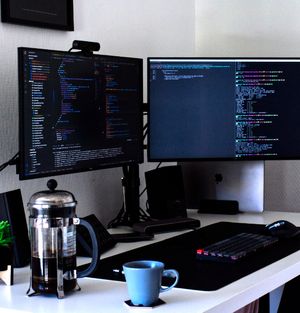
Image resolution: width=300 pixels, height=313 pixels. In order to click on apple computer in this screenshot , I will do `click(219, 180)`.